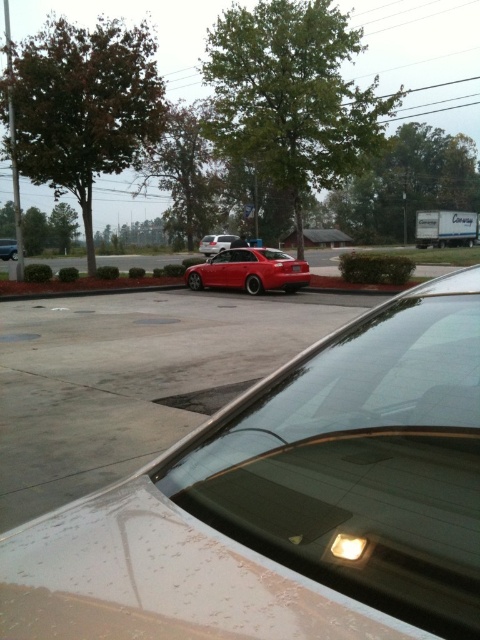
Can you confirm if smooth concrete curb at center is positioned to the left of satin silver sedan at center?

Indeed, smooth concrete curb at center is positioned on the left side of satin silver sedan at center.

Can you confirm if smooth concrete curb at center is smaller than satin silver sedan at center?

Yes.

Does point (106, 294) come farther from viewer compared to point (204, 250)?

No.

You are a GUI agent. You are given a task and a screenshot of the screen. Output one action in this format:
    pyautogui.click(x=<x>, y=<y>)
    Task: Click on the smooth concrete curb at center
    
    Given the screenshot: What is the action you would take?
    pyautogui.click(x=88, y=292)

Which is more to the right, shiny red sedan at center or satin silver sedan at center?

shiny red sedan at center

Looking at this image, which is above, shiny red sedan at center or satin silver sedan at center?

satin silver sedan at center

What are the coordinates of `shiny red sedan at center` in the screenshot? It's located at (250, 269).

Who is shorter, satin silver sedan at center or glossy red car at center?

With less height is glossy red car at center.

Which is more to the left, satin silver sedan at center or glossy red car at center?

From the viewer's perspective, glossy red car at center appears more on the left side.

This screenshot has width=480, height=640. I want to click on satin silver sedan at center, so click(216, 243).